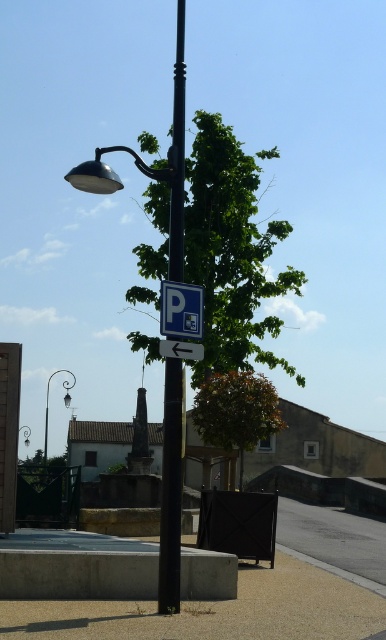
You are a delivery driver who needs to park your vehicle. You see the blue plastic parking sign at upper center and the polished brass street light at upper left. According to the sign, which direction should you turn to find parking?

The blue plastic parking sign at upper center has an arrow pointing left, so you should turn left to find parking.

Looking at this image, you are standing at the point labeled as point (170, 492) in the image. Looking around, you see a black lamppost situated on a concrete platform. What object is directly in front of you at that point?

The point (170, 492) corresponds to the metallic pole at center, so the metallic pole at center is directly in front of you at that point.